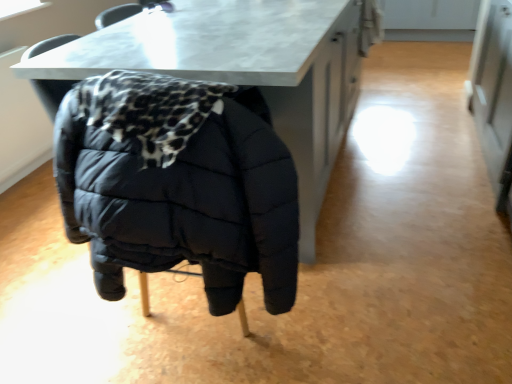
The height and width of the screenshot is (384, 512). What are the coordinates of `free space that is to the left of matte black puffer jacket at center` in the screenshot? It's located at (77, 321).